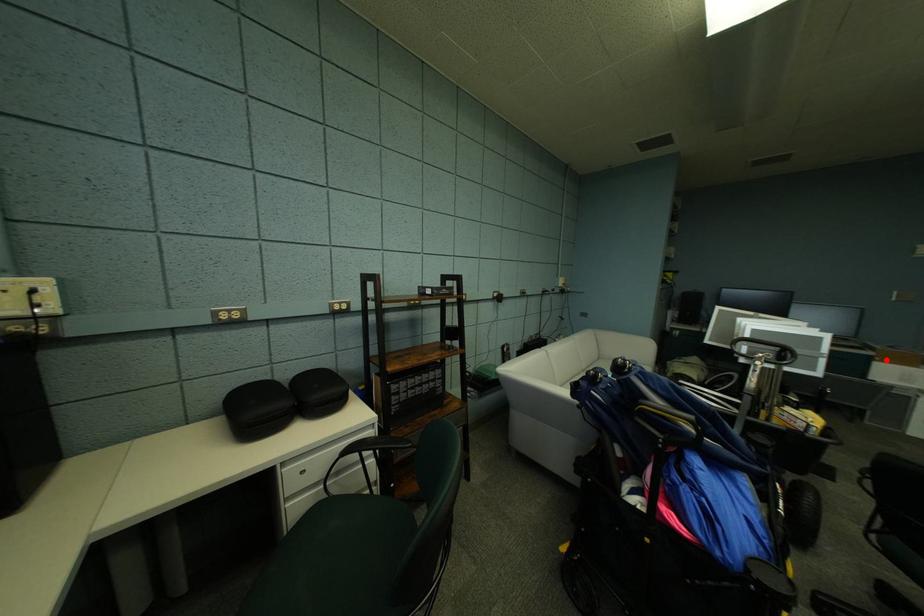
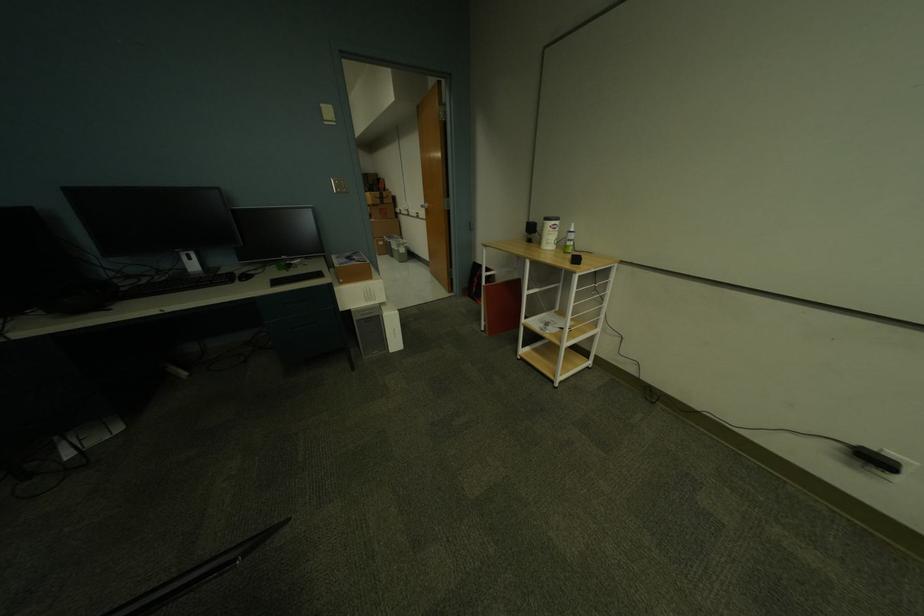
Find the pixel in the second image that matches the highlighted location in the first image.

(349, 282)